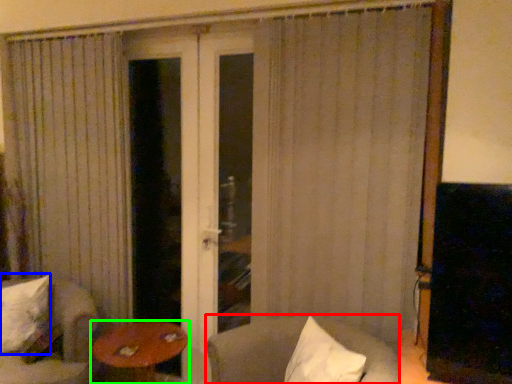
Question: Estimate the real-world distances between objects in this image. Which object is closer to chair (highlighted by a red box), pillow (highlighted by a blue box) or table (highlighted by a green box)?

Choices:
 (A) pillow
 (B) table

Answer: (B)